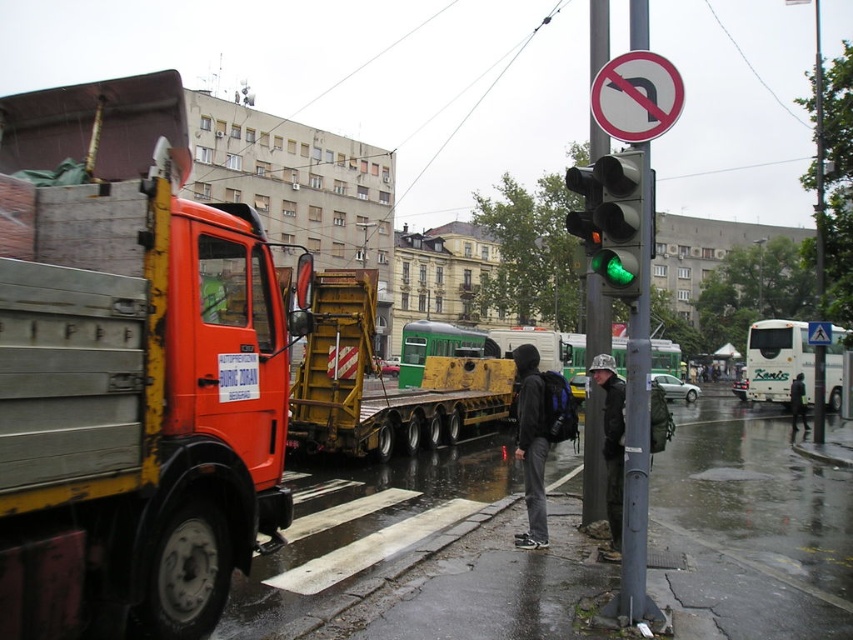
You are a delivery person who needs to drive a 3.5 meters tall truck through the street. The truck must pass between the metallic pole at center and the white matte bus at center right. Can the truck pass through without hitting any obstacles?

The metallic pole at center is taller than the white matte bus at center right. Since the truck is 3.5 meters tall, it is possible that the truck may hit the metallic pole at center if its height exceeds 3.5 meters. However, without knowing the exact height of the pole, it is uncertain whether the truck can pass safely.

In the scene shown: You are a pedestrian standing at the center of the street. You see the orange metallic truck at left and the dark gray fabric jacket at center. Which object is higher in the image?

The orange metallic truck at left is higher in the image than the dark gray fabric jacket at center.

You are a delivery person trying to see a sign on top of the metallic pole at center. You are wearing the dark gray hoodie at center. Can you see the top of the pole without moving your position?

The dark gray hoodie at center has a lesser height compared to metallic pole at center, so you cannot see the top of the pole without moving your position because the pole is taller than you.